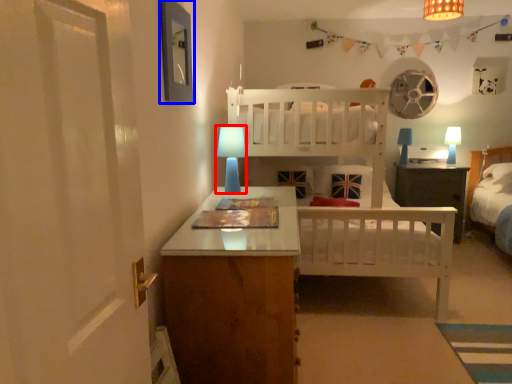
Question: Which object appears closest to the camera in this image, table lamp (highlighted by a red box) or picture frame (highlighted by a blue box)?

Choices:
 (A) table lamp
 (B) picture frame

Answer: (B)